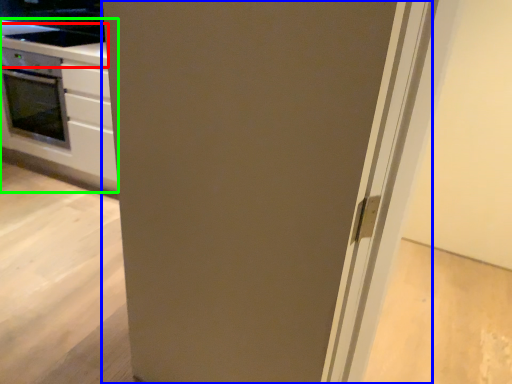
Question: Based on their relative distances, which object is nearer to counter top (highlighted by a red box)? Choose from door (highlighted by a blue box) and cabinetry (highlighted by a green box).

Choices:
 (A) door
 (B) cabinetry

Answer: (B)